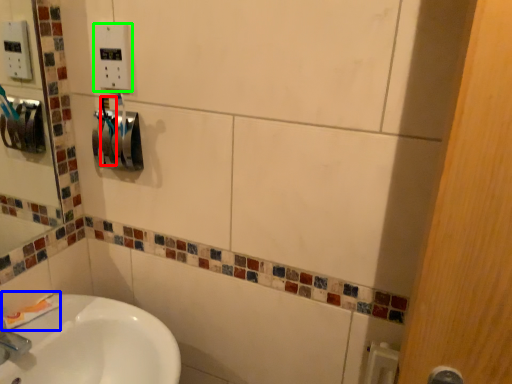
Question: Estimate the real-world distances between objects in this image. Which object is closer to toothbrush (highlighted by a red box), toothpaste (highlighted by a blue box) or electric outlet (highlighted by a green box)?

Choices:
 (A) toothpaste
 (B) electric outlet

Answer: (B)